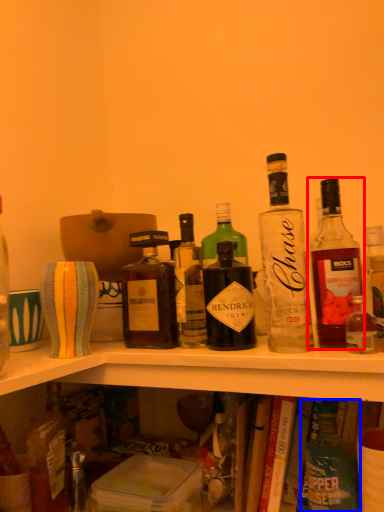
Question: Among these objects, which one is nearest to the camera, bottle (highlighted by a red box) or bottle (highlighted by a blue box)?

Choices:
 (A) bottle
 (B) bottle

Answer: (A)